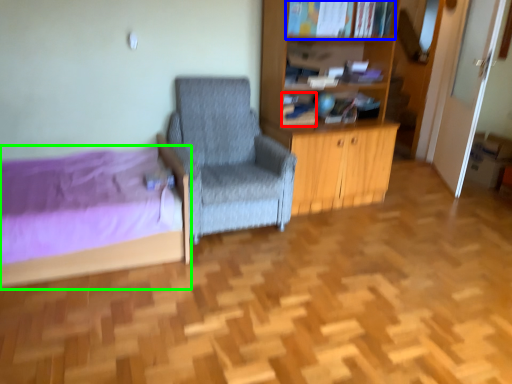
Question: Considering the real-world distances, which object is farthest from book (highlighted by a red box)? book (highlighted by a blue box) or bed (highlighted by a green box)?

Choices:
 (A) book
 (B) bed

Answer: (B)